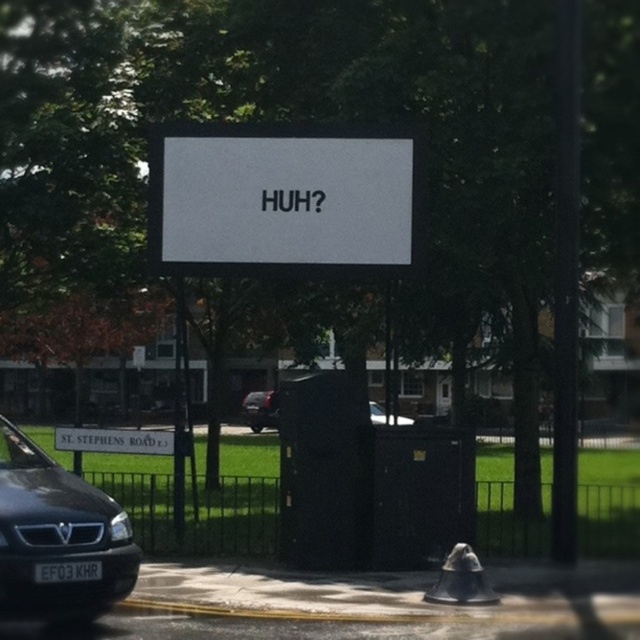
Between point (268, 177) and point (406, 419), which one is positioned in front?

Point (268, 177) is in front.

Between point (372, 189) and point (381, 413), which one is positioned behind?

The point (381, 413) is more distant.

Locate an element on the screen. white matte sign at center is located at coordinates (278, 196).

Can you confirm if white matte sign at center is positioned to the right of shiny black car at center?

Indeed, white matte sign at center is positioned on the right side of shiny black car at center.

Does white matte sign at center have a greater height compared to shiny black car at center?

Correct, white matte sign at center is much taller as shiny black car at center.

Is point (156, 157) less distant than point (262, 424)?

That is True.

Where is `white matte sign at center`? The width and height of the screenshot is (640, 640). white matte sign at center is located at coordinates (278, 196).

Does matte black van at lower left have a greater width compared to shiny black car at center?

Indeed, matte black van at lower left has a greater width compared to shiny black car at center.

Which is in front, point (70, 536) or point (268, 422)?

Positioned in front is point (70, 536).

You are a GUI agent. You are given a task and a screenshot of the screen. Output one action in this format:
    pyautogui.click(x=<x>, y=<y>)
    Task: Click on the matte black van at lower left
    The width and height of the screenshot is (640, 640).
    Given the screenshot: What is the action you would take?
    pyautogui.click(x=58, y=538)